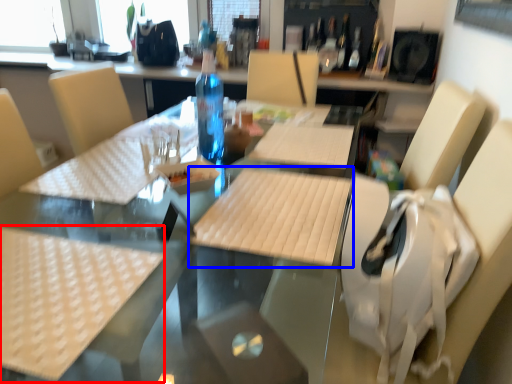
Question: Which point is further to the camera, tablecloth (highlighted by a red box) or plywood (highlighted by a blue box)?

Choices:
 (A) tablecloth
 (B) plywood

Answer: (B)